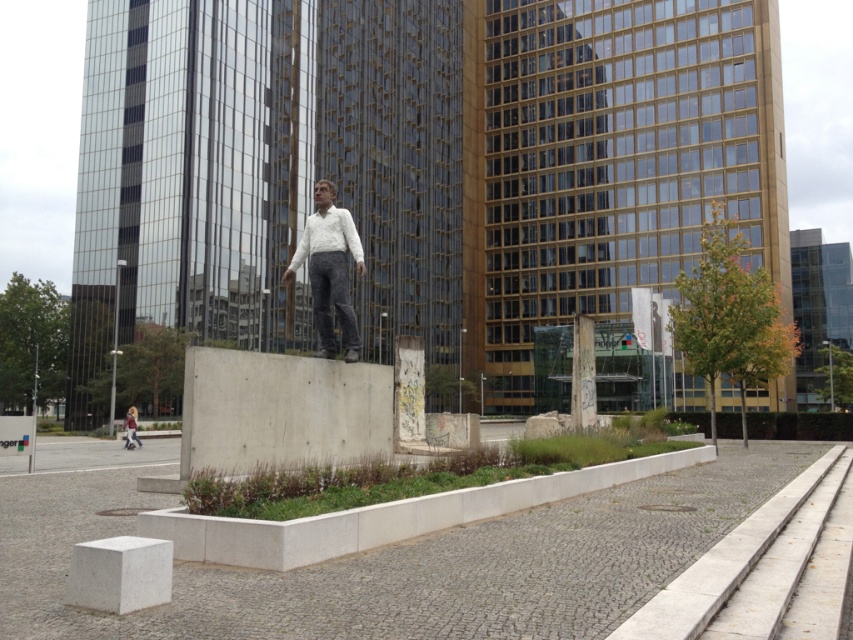
Which is below, white matte statue at center or light brown leather jacket at lower left?

Positioned lower is light brown leather jacket at lower left.

Is point (317, 218) less distant than point (128, 436)?

Yes.

Find the location of a particular element. The width and height of the screenshot is (853, 640). white matte statue at center is located at coordinates (329, 269).

Is concreteroughsculpture at center above white matte statue at center?

Incorrect, concreteroughsculpture at center is not positioned above white matte statue at center.

Where is `concreteroughsculpture at center`? concreteroughsculpture at center is located at coordinates click(281, 410).

At what (x,y) coordinates should I click in order to perform the action: click on concreteroughsculpture at center. Please return your answer as a coordinate pair (x, y). This screenshot has height=640, width=853. Looking at the image, I should click on (281, 410).

Which of these two, concreteroughsculpture at center or concrete at center, stands shorter?

Standing shorter between the two is concrete at center.

Does concreteroughsculpture at center have a smaller size compared to concrete at center?

Indeed, concreteroughsculpture at center has a smaller size compared to concrete at center.

Is point (343, 381) positioned after point (775, 602)?

Yes, point (343, 381) is behind point (775, 602).

Locate an element on the screen. This screenshot has width=853, height=640. concreteroughsculpture at center is located at coordinates (281, 410).